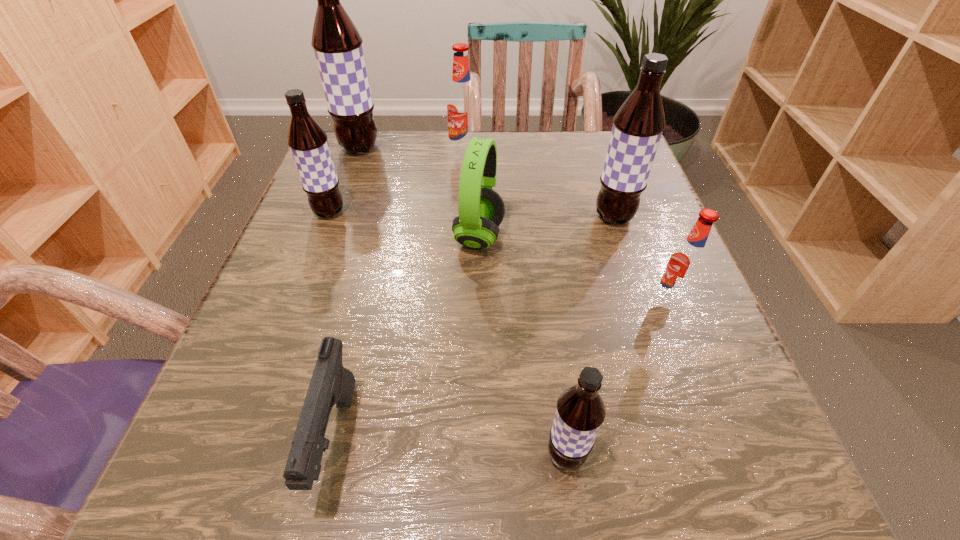
At what (x,y) coordinates should I click in order to perform the action: click on the tallest object. Please return your answer as a coordinate pair (x, y). Looking at the image, I should click on (337, 44).

Find the location of a particular element. Image resolution: width=960 pixels, height=540 pixels. the biggest brown root beer is located at coordinates (337, 44).

I want to click on the rightmost brown root beer, so click(637, 127).

Identify the location of the fifth shortest root beer. (637, 127).

Locate an element on the screen. The width and height of the screenshot is (960, 540). the third root beer from left to right is located at coordinates (462, 109).

Identify the location of the left red root beer. This screenshot has height=540, width=960. (462, 109).

Find the location of `the second smallest brown root beer`. the second smallest brown root beer is located at coordinates (308, 143).

I want to click on headset, so click(481, 210).

Locate an element on the screen. This screenshot has width=960, height=540. the nearer red root beer is located at coordinates (687, 263).

The image size is (960, 540). Identify the location of the second nearest root beer. (687, 263).